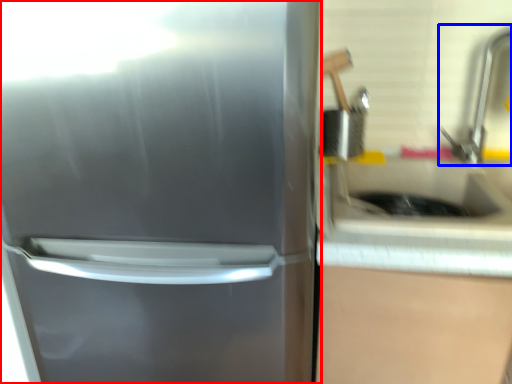
Question: Among these objects, which one is nearest to the camera, refrigerator (highlighted by a red box) or faucet (highlighted by a blue box)?

Choices:
 (A) refrigerator
 (B) faucet

Answer: (A)